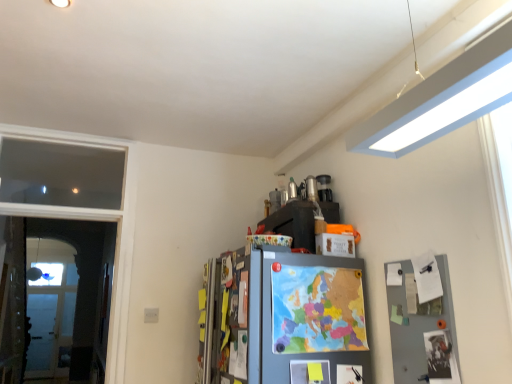
What do you see at coordinates (60, 174) in the screenshot? I see `transparent glass window at left` at bounding box center [60, 174].

Locate an element on the screen. The image size is (512, 384). transparent glass window at left is located at coordinates (60, 174).

Find the location of `clear glass screen door at left`. clear glass screen door at left is located at coordinates (52, 296).

Describe the element at coordinates (52, 296) in the screenshot. The width and height of the screenshot is (512, 384). I see `clear glass screen door at left` at that location.

Find the location of a particular element. transparent glass window at left is located at coordinates (60, 174).

Between clear glass screen door at left and transparent glass window at left, which one appears on the left side from the viewer's perspective?

transparent glass window at left.

Which object is closer to the camera, clear glass screen door at left or transparent glass window at left?

clear glass screen door at left is in front.

Which is behind, point (67, 334) or point (89, 202)?

The point (67, 334) is farther.

From the image's perspective, relative to transparent glass window at left, is clear glass screen door at left above or below?

Clearly, from the image's perspective, clear glass screen door at left is below transparent glass window at left.

From a real-world perspective, who is located higher, clear glass screen door at left or transparent glass window at left?

transparent glass window at left.

Which of these two, clear glass screen door at left or transparent glass window at left, is thinner?

clear glass screen door at left is thinner.

Looking at this image, who is shorter, clear glass screen door at left or transparent glass window at left?

Standing shorter between the two is transparent glass window at left.

Considering the sizes of clear glass screen door at left and transparent glass window at left in the image, is clear glass screen door at left bigger or smaller than transparent glass window at left?

Considering their sizes, clear glass screen door at left takes up more space than transparent glass window at left.

Would you say clear glass screen door at left contains transparent glass window at left?

Result: No, transparent glass window at left is not surrounded by clear glass screen door at left.

Is clear glass screen door at left with transparent glass window at left?

No, clear glass screen door at left is not touching transparent glass window at left.

Is clear glass screen door at left positioned with its back to transparent glass window at left?

Correct, clear glass screen door at left is looking away from transparent glass window at left.

Can you tell me how much clear glass screen door at left and transparent glass window at left differ in facing direction?

The angle between the facing direction of clear glass screen door at left and the facing direction of transparent glass window at left is 0.616 degrees.

The image size is (512, 384). I want to click on window that is above the clear glass screen door at left (from a real-world perspective), so click(x=60, y=174).

Which is more to the left, transparent glass window at left or clear glass screen door at left?

Positioned to the left is transparent glass window at left.

Is transparent glass window at left positioned before clear glass screen door at left?

No.

Which is nearer, (49, 142) or (74, 283)?

Point (49, 142) appears to be closer to the viewer than point (74, 283).

From the image's perspective, which one is positioned higher, transparent glass window at left or clear glass screen door at left?

transparent glass window at left.

From a real-world perspective, does transparent glass window at left stand above clear glass screen door at left?

Indeed, from a real-world perspective, transparent glass window at left stands above clear glass screen door at left.

Which of these two, transparent glass window at left or clear glass screen door at left, is thinner?

Thinner between the two is clear glass screen door at left.

From their relative heights in the image, would you say transparent glass window at left is taller or shorter than clear glass screen door at left?

Considering their sizes, transparent glass window at left has less height than clear glass screen door at left.

Considering the sizes of transparent glass window at left and clear glass screen door at left in the image, is transparent glass window at left bigger or smaller than clear glass screen door at left?

transparent glass window at left is smaller than clear glass screen door at left.

Could clear glass screen door at left be considered to be inside transparent glass window at left?

That's incorrect, clear glass screen door at left is not inside transparent glass window at left.

Is transparent glass window at left far away from clear glass screen door at left?

Absolutely, transparent glass window at left is distant from clear glass screen door at left.

Is transparent glass window at left turned away from clear glass screen door at left?

No, clear glass screen door at left is not at the back of transparent glass window at left.

How many degrees apart are the facing directions of transparent glass window at left and clear glass screen door at left?

There is a 0.616-degree angle between the facing directions of transparent glass window at left and clear glass screen door at left.

The image size is (512, 384). Find the location of `screen door on the right of transparent glass window at left`. screen door on the right of transparent glass window at left is located at coordinates (52, 296).

At what (x,y) coordinates should I click in order to perform the action: click on window above the clear glass screen door at left (from the image's perspective). Please return your answer as a coordinate pair (x, y). The width and height of the screenshot is (512, 384). Looking at the image, I should click on (60, 174).

Identify the location of screen door that is in front of the transparent glass window at left. Image resolution: width=512 pixels, height=384 pixels. (52, 296).